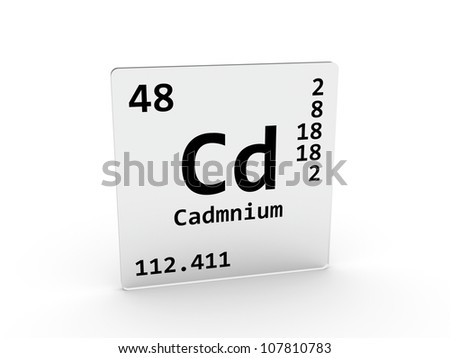
At what (x,y) coordinates should I click in order to perform the action: click on left corner. Please return your answer as a coordinate pair (x, y). The width and height of the screenshot is (450, 358). Looking at the image, I should click on (114, 72).